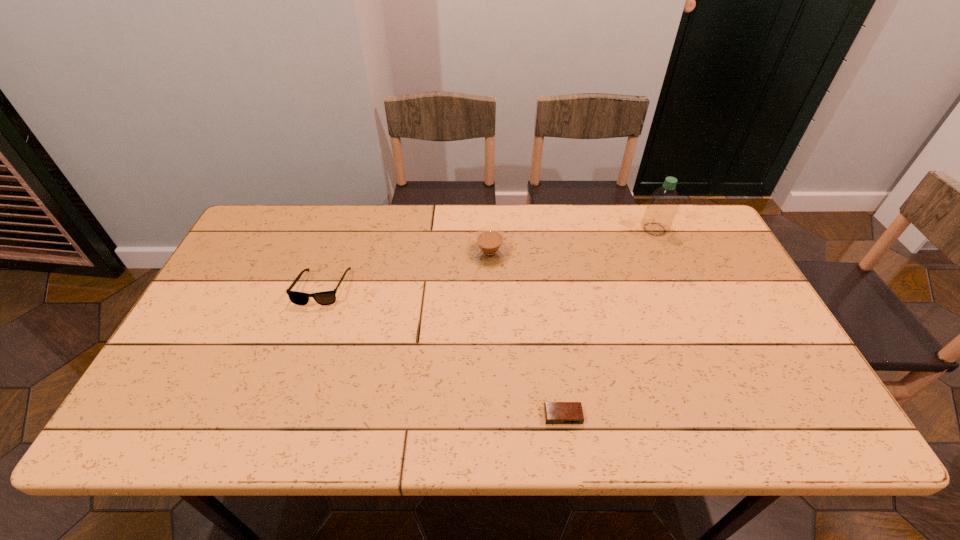
Locate an element on the screen. vacant space at the far left corner of the desktop is located at coordinates (296, 228).

The height and width of the screenshot is (540, 960). What are the coordinates of `vacant space at the far right corner of the desktop` in the screenshot? It's located at click(x=709, y=224).

This screenshot has height=540, width=960. I want to click on free space between the leftmost object and the third nearest object, so click(x=406, y=270).

At what (x,y) coordinates should I click in order to perform the action: click on vacant area between the farthest object and the nearest object. Please return your answer as a coordinate pair (x, y). Looking at the image, I should click on (609, 322).

Where is `free spot between the water bottle and the cappuccino`? free spot between the water bottle and the cappuccino is located at coordinates (572, 241).

Locate an element on the screen. vacant point located between the leftmost object and the third object from right to left is located at coordinates (406, 270).

Locate an element on the screen. This screenshot has width=960, height=540. vacant space that is in between the second shortest object and the third object from right to left is located at coordinates (406, 270).

Identify the location of vacant point located between the water bottle and the third object from left to right. The height and width of the screenshot is (540, 960). (x=609, y=322).

Locate an element on the screen. This screenshot has height=540, width=960. vacant region between the cappuccino and the farthest object is located at coordinates 572,241.

Locate an element on the screen. The width and height of the screenshot is (960, 540). vacant point located between the alarm clock and the second shortest object is located at coordinates (443, 352).